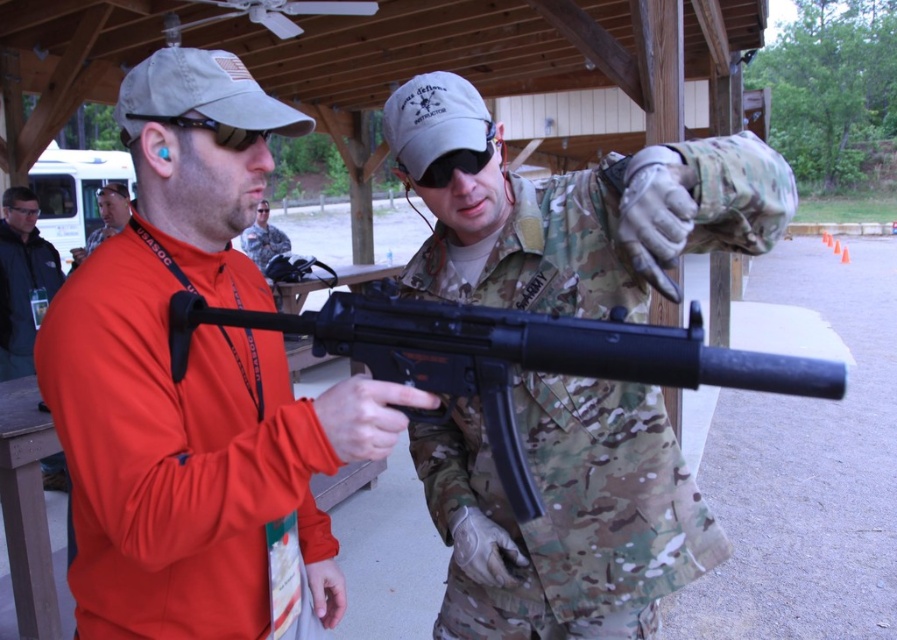
Can you confirm if matte black rifle at center is positioned above camouflage uniform at center?

Actually, matte black rifle at center is below camouflage uniform at center.

Does matte black rifle at center have a lesser height compared to camouflage uniform at center?

No.

Where is `matte black rifle at center`? matte black rifle at center is located at coordinates (196, 387).

Does matte black rifle at center have a smaller size compared to dark gray jacket at left?

Indeed, matte black rifle at center has a smaller size compared to dark gray jacket at left.

Can you confirm if matte black rifle at center is taller than dark gray jacket at left?

Incorrect, matte black rifle at center's height is not larger of dark gray jacket at left's.

At what (x,y) coordinates should I click in order to perform the action: click on matte black rifle at center. Please return your answer as a coordinate pair (x, y). Looking at the image, I should click on (196, 387).

Is matte black rifle at center thinner than camouflage fabric rifle at center?

Incorrect, matte black rifle at center's width is not less than camouflage fabric rifle at center's.

Identify the location of matte black rifle at center. The height and width of the screenshot is (640, 897). (196, 387).

Identify the location of matte black rifle at center. The height and width of the screenshot is (640, 897). (196, 387).